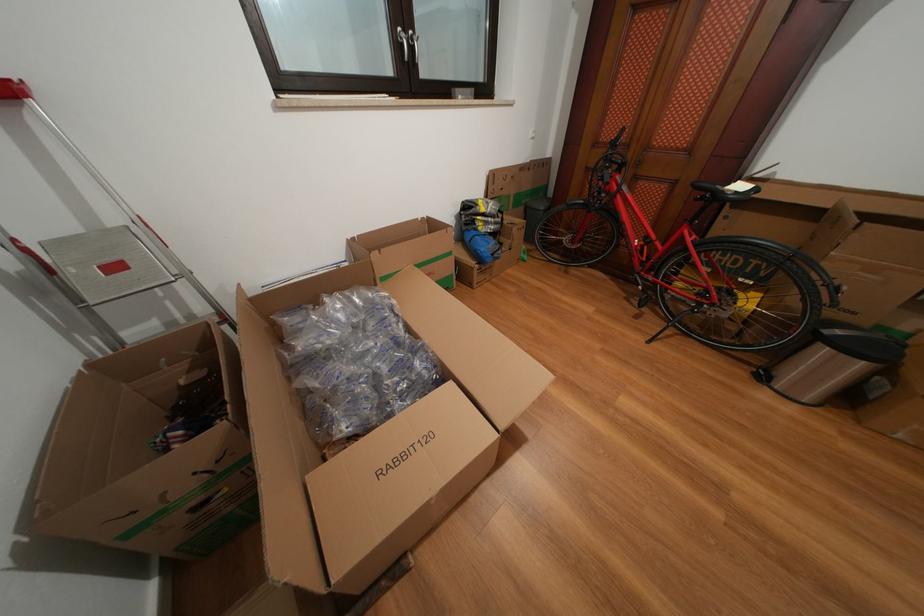
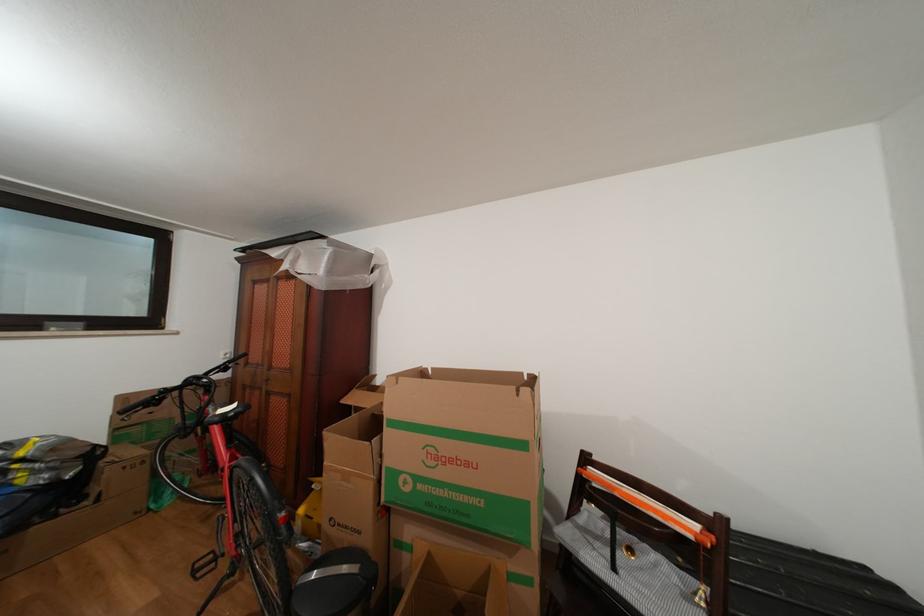
The point at [747,192] is marked in the first image. Where is the corresponding point in the second image?

(237, 413)